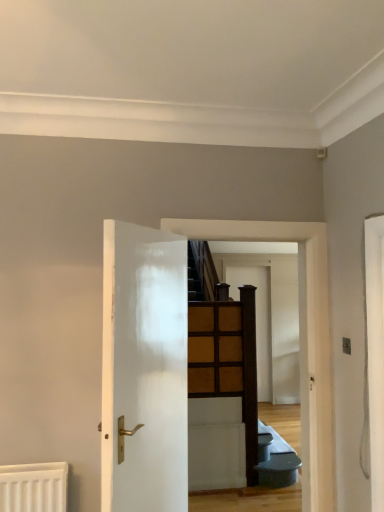
Image resolution: width=384 pixels, height=512 pixels. What do you see at coordinates (257, 319) in the screenshot?
I see `wooden at center, which ranks as the second door in front-to-back order` at bounding box center [257, 319].

Measure the distance between point (256, 337) and camera.

Point (256, 337) and camera are 6.84 meters apart from each other.

Identify the location of wooden at center, which appears as the 2th door when viewed from the left. The width and height of the screenshot is (384, 512). (257, 319).

The height and width of the screenshot is (512, 384). What do you see at coordinates (144, 370) in the screenshot? I see `white glossy door at center, placed as the first door when sorted from front to back` at bounding box center [144, 370].

You are a GUI agent. You are given a task and a screenshot of the screen. Output one action in this format:
    pyautogui.click(x=<x>, y=<y>)
    Task: Click on the white glossy door at center, placed as the first door when sorted from front to back
    This screenshot has height=512, width=384.
    Given the screenshot: What is the action you would take?
    point(144,370)

What are the coordinates of `wooden at center, which appears as the 2th door when viewed from the left` in the screenshot? It's located at (257, 319).

Between white glossy door at center, the 2th door from the back, and wooden at center, which ranks as the first door in right-to-left order, which one appears on the left side from the viewer's perspective?

white glossy door at center, the 2th door from the back, is more to the left.

Is white glossy door at center, placed as the first door when sorted from front to back, further to the viewer compared to wooden at center, which ranks as the second door in front-to-back order?

No, white glossy door at center, placed as the first door when sorted from front to back, is in front of wooden at center, which ranks as the second door in front-to-back order.

Which is in front, point (173, 244) or point (268, 280)?

The point (173, 244) is closer.

From the image's perspective, is white glossy door at center, acting as the 2th door starting from the right, beneath wooden at center, placed as the 1th door when sorted from back to front?

Actually, white glossy door at center, acting as the 2th door starting from the right, appears above wooden at center, placed as the 1th door when sorted from back to front, in the image.

From a real-world perspective, is white glossy door at center, the 2th door from the back, physically located above or below wooden at center, which ranks as the second door in front-to-back order?

white glossy door at center, the 2th door from the back, is situated higher than wooden at center, which ranks as the second door in front-to-back order, in the real world.

Does white glossy door at center, the 2th door from the back, have a greater width compared to wooden at center, which ranks as the first door in right-to-left order?

Correct, the width of white glossy door at center, the 2th door from the back, exceeds that of wooden at center, which ranks as the first door in right-to-left order.

Considering the sizes of white glossy door at center, placed as the first door when sorted from front to back, and wooden at center, placed as the 1th door when sorted from back to front, in the image, is white glossy door at center, placed as the first door when sorted from front to back, taller or shorter than wooden at center, placed as the 1th door when sorted from back to front,?

white glossy door at center, placed as the first door when sorted from front to back, is shorter than wooden at center, placed as the 1th door when sorted from back to front.

Consider the image. Considering the sizes of objects white glossy door at center, placed as the first door when sorted from front to back, and wooden at center, which appears as the 2th door when viewed from the left, in the image provided, who is smaller, white glossy door at center, placed as the first door when sorted from front to back, or wooden at center, which appears as the 2th door when viewed from the left,?

Smaller between the two is wooden at center, which appears as the 2th door when viewed from the left.

Is white glossy door at center, acting as the 2th door starting from the right, spatially inside wooden at center, which appears as the 2th door when viewed from the left, or outside of it?

white glossy door at center, acting as the 2th door starting from the right, is spatially situated outside wooden at center, which appears as the 2th door when viewed from the left.

Is white glossy door at center, the first door positioned from the left, in contact with wooden at center, placed as the 1th door when sorted from back to front?

They are not placed beside each other.

Is white glossy door at center, placed as the first door when sorted from front to back, facing towards wooden at center, which appears as the 2th door when viewed from the left?

No, white glossy door at center, placed as the first door when sorted from front to back, is not aimed at wooden at center, which appears as the 2th door when viewed from the left.

Could you measure the distance between white glossy door at center, placed as the first door when sorted from front to back, and wooden at center, which ranks as the first door in right-to-left order?

A distance of 4.78 meters exists between white glossy door at center, placed as the first door when sorted from front to back, and wooden at center, which ranks as the first door in right-to-left order.

I want to click on door in front of the wooden at center, which ranks as the first door in right-to-left order, so click(144, 370).

In the image, is wooden at center, placed as the 1th door when sorted from back to front, on the left side or the right side of white glossy door at center, acting as the 2th door starting from the right?

wooden at center, placed as the 1th door when sorted from back to front, is positioned on white glossy door at center, acting as the 2th door starting from the right,'s right side.

In the image, is wooden at center, placed as the 1th door when sorted from back to front, positioned in front of or behind white glossy door at center, acting as the 2th door starting from the right?

Clearly, wooden at center, placed as the 1th door when sorted from back to front, is behind white glossy door at center, acting as the 2th door starting from the right.

Considering the points (268, 374) and (138, 266), which point is in front, point (268, 374) or point (138, 266)?

The point (138, 266) is closer.

From the image's perspective, is wooden at center, which appears as the 2th door when viewed from the left, on top of white glossy door at center, placed as the first door when sorted from front to back?

No, from the image's perspective, wooden at center, which appears as the 2th door when viewed from the left, is not above white glossy door at center, placed as the first door when sorted from front to back.

Based on the photo, from a real-world perspective, who is located higher, wooden at center, placed as the 1th door when sorted from back to front, or white glossy door at center, the first door positioned from the left?

white glossy door at center, the first door positioned from the left, is physically above.

Which object is thinner, wooden at center, placed as the 1th door when sorted from back to front, or white glossy door at center, the 2th door from the back?

With smaller width is wooden at center, placed as the 1th door when sorted from back to front.

Considering the relative sizes of wooden at center, which ranks as the second door in front-to-back order, and white glossy door at center, placed as the first door when sorted from front to back, in the image provided, is wooden at center, which ranks as the second door in front-to-back order, shorter than white glossy door at center, placed as the first door when sorted from front to back,?

Incorrect, the height of wooden at center, which ranks as the second door in front-to-back order, does not fall short of that of white glossy door at center, placed as the first door when sorted from front to back.

Which of these two, wooden at center, which ranks as the first door in right-to-left order, or white glossy door at center, placed as the first door when sorted from front to back, is bigger?

With larger size is white glossy door at center, placed as the first door when sorted from front to back.

Is wooden at center, which ranks as the second door in front-to-back order, outside of white glossy door at center, the 2th door from the back?

wooden at center, which ranks as the second door in front-to-back order, lies outside white glossy door at center, the 2th door from the back,'s area.

Are wooden at center, which appears as the 2th door when viewed from the left, and white glossy door at center, placed as the first door when sorted from front to back, far apart?

wooden at center, which appears as the 2th door when viewed from the left, is far away from white glossy door at center, placed as the first door when sorted from front to back.

Could you tell me if wooden at center, placed as the 1th door when sorted from back to front, is facing white glossy door at center, acting as the 2th door starting from the right?

No.

Can you tell me how much wooden at center, placed as the 1th door when sorted from back to front, and white glossy door at center, placed as the first door when sorted from front to back, differ in facing direction?

There is a 59.2-degree angle between the facing directions of wooden at center, placed as the 1th door when sorted from back to front, and white glossy door at center, placed as the first door when sorted from front to back.

At what (x,y) coordinates should I click in order to perform the action: click on door behind the white glossy door at center, placed as the first door when sorted from front to back. Please return your answer as a coordinate pair (x, y). This screenshot has height=512, width=384. Looking at the image, I should click on (257, 319).

There is a wooden at center, which appears as the 2th door when viewed from the left. In order to click on door above it (from a real-world perspective) in this screenshot , I will do pos(144,370).

You are a GUI agent. You are given a task and a screenshot of the screen. Output one action in this format:
    pyautogui.click(x=<x>, y=<y>)
    Task: Click on the door on the right of the white glossy door at center, acting as the 2th door starting from the right
    
    Given the screenshot: What is the action you would take?
    pyautogui.click(x=257, y=319)